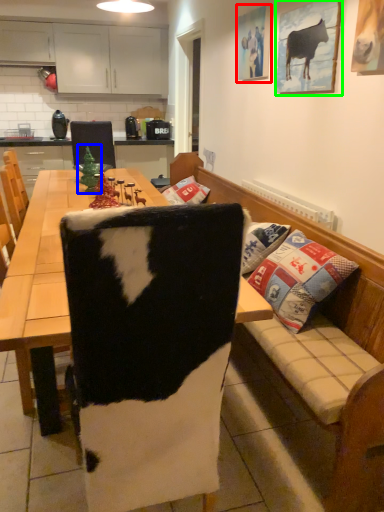
Question: Based on their relative distances, which object is nearer to picture frame (highlighted by a red box)? Choose from christmas tree (highlighted by a blue box) and picture frame (highlighted by a green box).

Choices:
 (A) christmas tree
 (B) picture frame

Answer: (B)